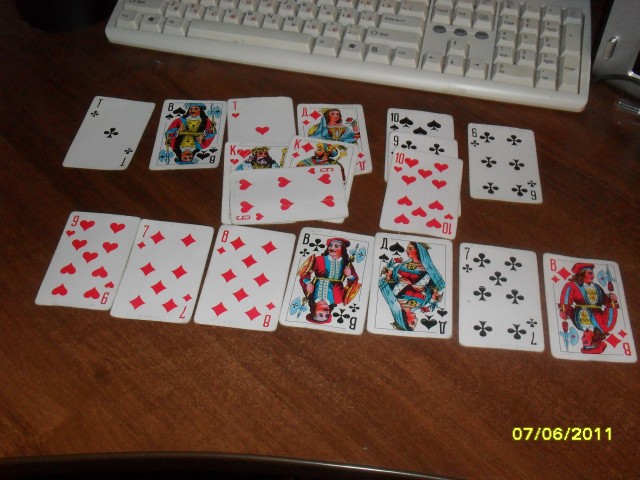
Locate an element on the screen. The image size is (640, 480). white keyboard half off top of pic is located at coordinates (553, 54), (370, 32), (180, 12).